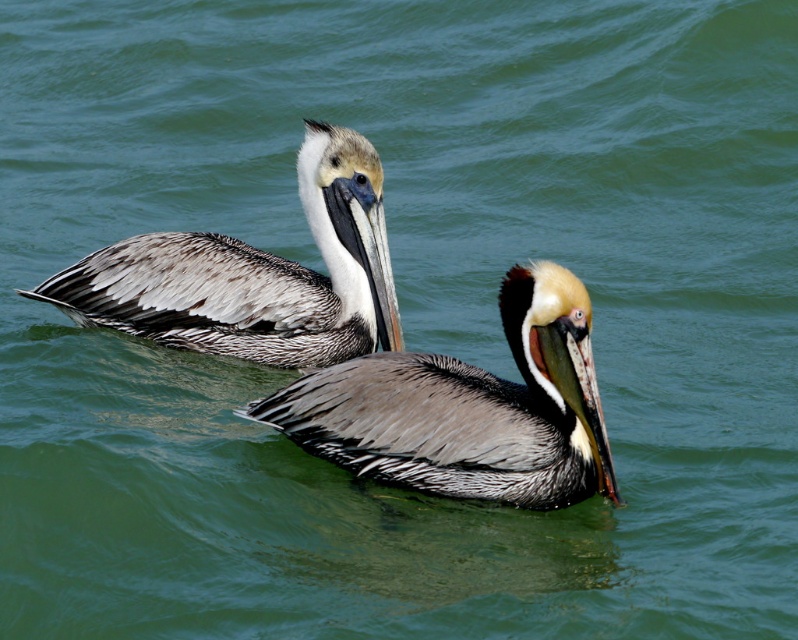
Question: Where is brown feathered pelican at center located in relation to brown speckled pelican at upper left in the image?

Choices:
 (A) left
 (B) right

Answer: (B)

Question: Is brown feathered pelican at center to the left of brown speckled pelican at upper left from the viewer's perspective?

Choices:
 (A) yes
 (B) no

Answer: (B)

Question: Does brown feathered pelican at center appear over brown speckled pelican at upper left?

Choices:
 (A) no
 (B) yes

Answer: (A)